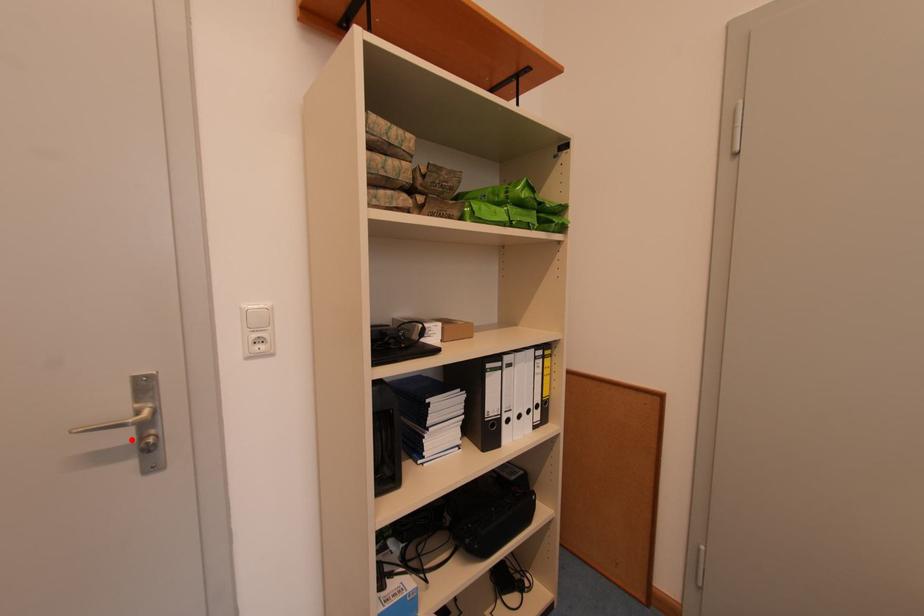
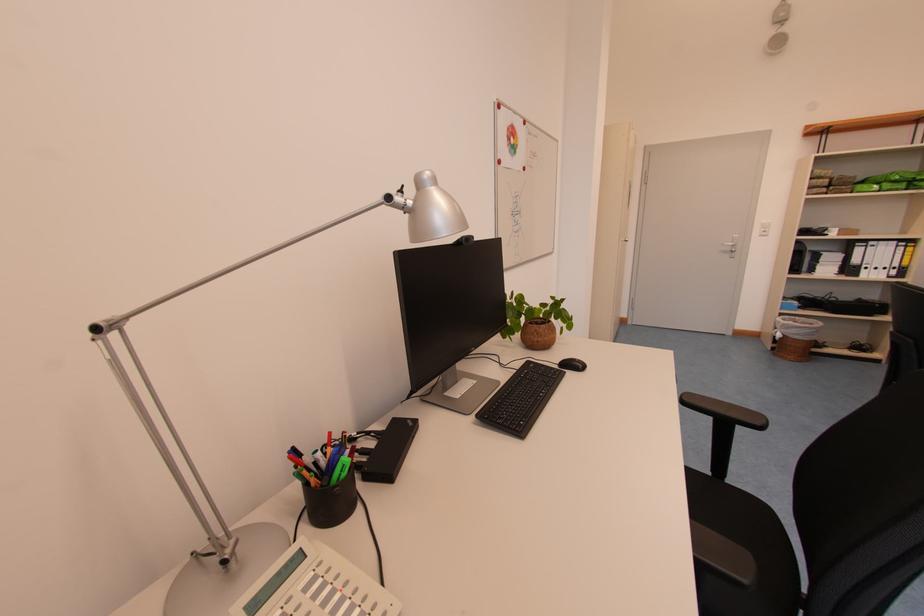
Find the pixel in the second image that matches the highlighted location in the first image.

(736, 252)